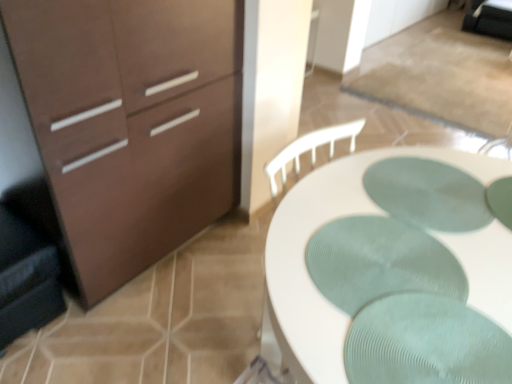
I want to click on vacant space in front of green textured placemat at center, which appears as the first oval when viewed from the top, so click(x=433, y=275).